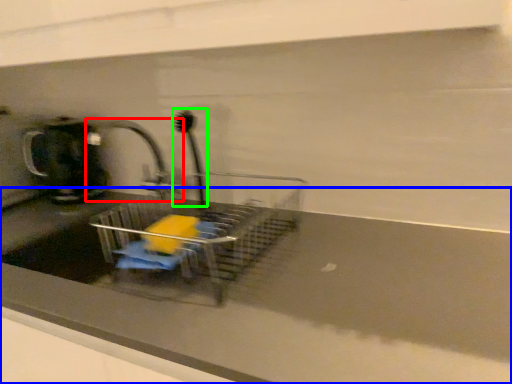
Question: Which is nearer to the tap (highlighted by a red box)? counter top (highlighted by a blue box) or brush (highlighted by a green box).

Choices:
 (A) counter top
 (B) brush

Answer: (B)